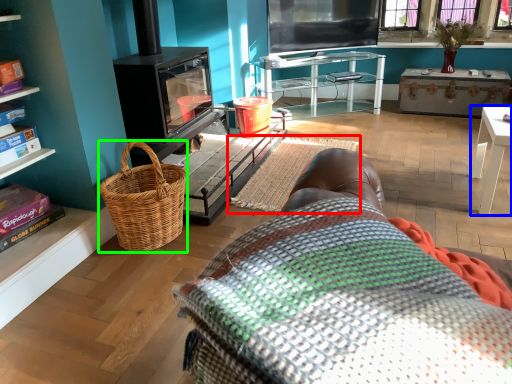
Question: Estimate the real-world distances between objects in this image. Which object is closer to blanket (highlighted by a red box), table (highlighted by a blue box) or picnic basket (highlighted by a green box)?

Choices:
 (A) table
 (B) picnic basket

Answer: (B)